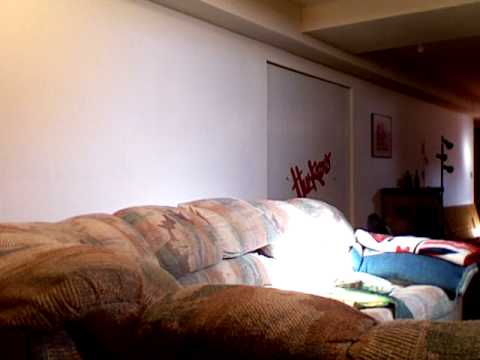
This screenshot has height=360, width=480. Identify the location of blanket on armrest. (400, 246).